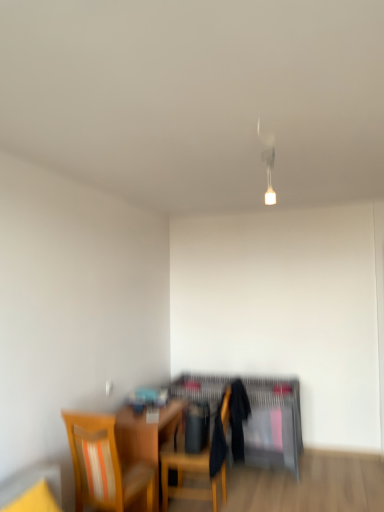
The height and width of the screenshot is (512, 384). Find the location of `wooden chair with striped cushion at lower left, which is the 1th chair from left to right`. wooden chair with striped cushion at lower left, which is the 1th chair from left to right is located at coordinates (104, 466).

What do you see at coordinates (189, 474) in the screenshot? I see `wooden chair at center, the first chair in the back-to-front sequence` at bounding box center [189, 474].

Identify the location of wooden chair with striped cushion at lower left, marked as the 2th chair in a back-to-front arrangement. This screenshot has width=384, height=512. (104, 466).

Is matte black desk at center shorter than wooden table at center?

In fact, matte black desk at center may be taller than wooden table at center.

Which is behind, matte black desk at center or wooden table at center?

matte black desk at center is behind.

Does matte black desk at center turn towards wooden table at center?

Yes, matte black desk at center faces towards wooden table at center.

Is point (211, 386) more distant than point (170, 416)?

That is True.

Which object is further away from the camera, wooden chair at center, the second chair viewed from the left, or wooden chair with striped cushion at lower left, marked as the 2th chair in a back-to-front arrangement?

wooden chair at center, the second chair viewed from the left, is more distant.

This screenshot has height=512, width=384. I want to click on chair below the wooden chair with striped cushion at lower left, marked as the 2th chair in a back-to-front arrangement (from a real-world perspective), so click(189, 474).

Which of these two, wooden chair at center, the first chair in the back-to-front sequence, or wooden chair with striped cushion at lower left, the first chair in the front-to-back sequence, is bigger?

Bigger between the two is wooden chair at center, the first chair in the back-to-front sequence.

Can you tell me how much wooden chair at center, which is counted as the second chair, starting from the front, and wooden chair with striped cushion at lower left, marked as the 2th chair in a back-to-front arrangement, differ in facing direction?

The angular difference between wooden chair at center, which is counted as the second chair, starting from the front, and wooden chair with striped cushion at lower left, marked as the 2th chair in a back-to-front arrangement, is 93 degrees.

From the picture: Is wooden table at center placed right next to wooden chair at center, placed as the first chair when sorted from right to left?

No, wooden table at center is not making contact with wooden chair at center, placed as the first chair when sorted from right to left.

Is wooden table at center oriented towards wooden chair at center, the second chair viewed from the left?

Yes, wooden table at center faces towards wooden chair at center, the second chair viewed from the left.

How much distance is there between wooden table at center and wooden chair at center, which is counted as the second chair, starting from the front?

wooden table at center is 9.10 inches away from wooden chair at center, which is counted as the second chair, starting from the front.

Which point is more forward, (146,439) or (162,471)?

The point (146,439) is in front.

From a real-world perspective, which object rests below the other?

From a 3D spatial view, matte black desk at center is below.

Considering the positions of points (197, 379) and (225, 411), is point (197, 379) farther from camera compared to point (225, 411)?

Yes, it is.

From the picture: Considering the positions of objects matte black desk at center and wooden chair at center, the second chair viewed from the left, in the image provided, who is behind, matte black desk at center or wooden chair at center, the second chair viewed from the left,?

matte black desk at center is further from the camera.

Is there a large distance between matte black desk at center and wooden chair with striped cushion at lower left, which is the 1th chair from left to right?

Yes, matte black desk at center is far from wooden chair with striped cushion at lower left, which is the 1th chair from left to right.

Between matte black desk at center and wooden chair with striped cushion at lower left, acting as the second chair starting from the right, which one is positioned behind?

matte black desk at center.

Which object is positioned more to the right, matte black desk at center or wooden chair with striped cushion at lower left, marked as the 2th chair in a back-to-front arrangement?

Positioned to the right is matte black desk at center.

Does matte black desk at center turn towards wooden chair with striped cushion at lower left, which is the 1th chair from left to right?

Yes.

From the image's perspective, which one is positioned lower, wooden chair at center, the second chair viewed from the left, or matte black desk at center?

matte black desk at center, from the image's perspective.

Who is more distant, wooden chair at center, placed as the first chair when sorted from right to left, or matte black desk at center?

matte black desk at center.

Is wooden chair at center, the first chair in the back-to-front sequence, aimed at matte black desk at center?

No, wooden chair at center, the first chair in the back-to-front sequence, is not aimed at matte black desk at center.

Between wooden table at center and matte black desk at center, which one is positioned behind?

matte black desk at center.

Considering the relative sizes of wooden table at center and matte black desk at center in the image provided, is wooden table at center wider than matte black desk at center?

→ No, wooden table at center is not wider than matte black desk at center.

Could you tell me if wooden table at center is turned towards matte black desk at center?

No, wooden table at center is not aimed at matte black desk at center.

Locate an element on the screen. The height and width of the screenshot is (512, 384). table located on the left of matte black desk at center is located at coordinates (146, 435).

You are a GUI agent. You are given a task and a screenshot of the screen. Output one action in this format:
    pyautogui.click(x=<x>, y=<y>)
    Task: Click on the chair on the right of wooden chair with striped cushion at lower left, marked as the 2th chair in a back-to-front arrangement
    
    Given the screenshot: What is the action you would take?
    pyautogui.click(x=189, y=474)

Based on their spatial positions, is wooden table at center or matte black desk at center further from wooden chair at center, placed as the first chair when sorted from right to left?

The object further to wooden chair at center, placed as the first chair when sorted from right to left, is matte black desk at center.

Which object lies further to the anchor point wooden table at center, wooden chair at center, placed as the first chair when sorted from right to left, or matte black desk at center?

Based on the image, matte black desk at center appears to be further to wooden table at center.

From the image, which object appears to be nearer to wooden table at center, wooden chair with striped cushion at lower left, acting as the second chair starting from the right, or wooden chair at center, placed as the first chair when sorted from right to left?

The object closer to wooden table at center is wooden chair at center, placed as the first chair when sorted from right to left.

From the image, which object appears to be nearer to wooden chair with striped cushion at lower left, which is the 1th chair from left to right, matte black desk at center or wooden chair at center, which is counted as the second chair, starting from the front?

The object closer to wooden chair with striped cushion at lower left, which is the 1th chair from left to right, is wooden chair at center, which is counted as the second chair, starting from the front.

Estimate the real-world distances between objects in this image. Which object is closer to wooden chair at center, placed as the first chair when sorted from right to left, wooden chair with striped cushion at lower left, acting as the second chair starting from the right, or wooden table at center?

wooden table at center is closer to wooden chair at center, placed as the first chair when sorted from right to left.

Considering their positions, is wooden chair with striped cushion at lower left, the first chair in the front-to-back sequence, positioned closer to matte black desk at center than wooden table at center?

Based on the image, wooden table at center appears to be nearer to matte black desk at center.

Considering their positions, is matte black desk at center positioned further to wooden chair with striped cushion at lower left, acting as the second chair starting from the right, than wooden table at center?

Among the two, matte black desk at center is located further to wooden chair with striped cushion at lower left, acting as the second chair starting from the right.

Looking at the image, which one is located closer to matte black desk at center, wooden table at center or wooden chair with striped cushion at lower left, acting as the second chair starting from the right?

wooden table at center lies closer to matte black desk at center than the other object.

Locate an element on the screen. This screenshot has height=512, width=384. chair between wooden chair with striped cushion at lower left, which is the 1th chair from left to right, and matte black desk at center from front to back is located at coordinates (189, 474).

Identify the location of chair situated between wooden table at center and matte black desk at center from left to right. 189,474.

At what (x,y) coordinates should I click in order to perform the action: click on table between wooden chair with striped cushion at lower left, acting as the second chair starting from the right, and matte black desk at center from front to back. Please return your answer as a coordinate pair (x, y). The height and width of the screenshot is (512, 384). Looking at the image, I should click on (146, 435).

Where is `chair between wooden chair with striped cushion at lower left, marked as the 2th chair in a back-to-front arrangement, and wooden table at center from front to back`? This screenshot has width=384, height=512. chair between wooden chair with striped cushion at lower left, marked as the 2th chair in a back-to-front arrangement, and wooden table at center from front to back is located at coordinates (189, 474).